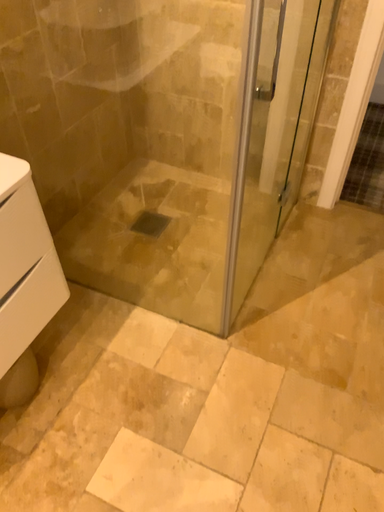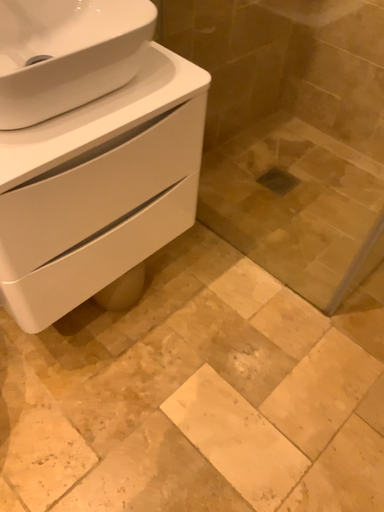
Question: Which way did the camera rotate in the video?

Choices:
 (A) rotated left
 (B) rotated right

Answer: (A)